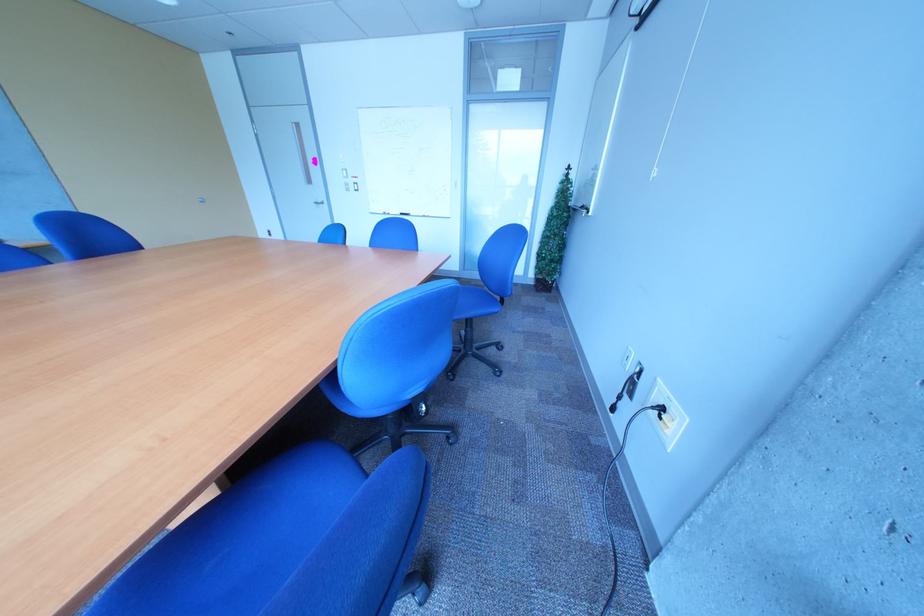
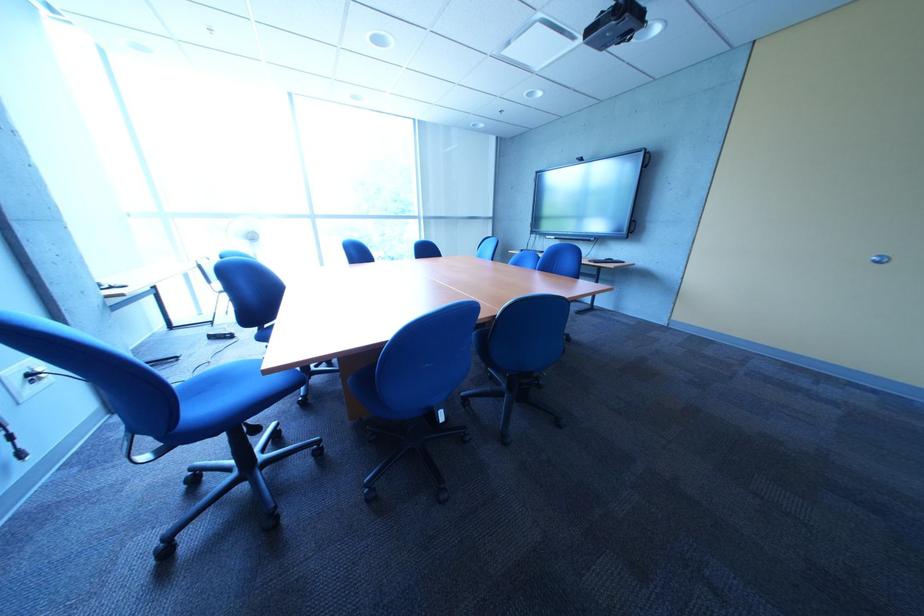
Question: I am providing you with two images of the same scene from different viewpoints. After the viewpoint changes to image2, which objects are now occluded?

Choices:
 (A) blue chair sitting surface
 (B) power outlet
 (C) white floor fan
 (D) metal handrail

Answer: (A)